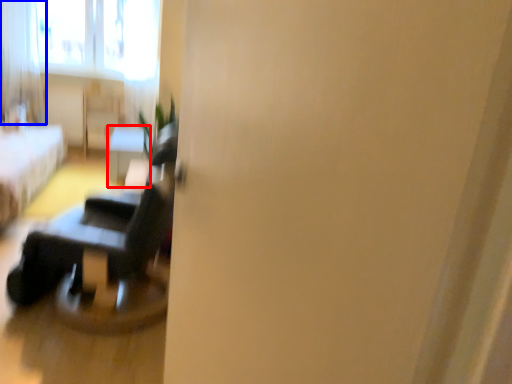
Question: Which point is closer to the camera, table (highlighted by a red box) or curtain (highlighted by a blue box)?

Choices:
 (A) table
 (B) curtain

Answer: (A)